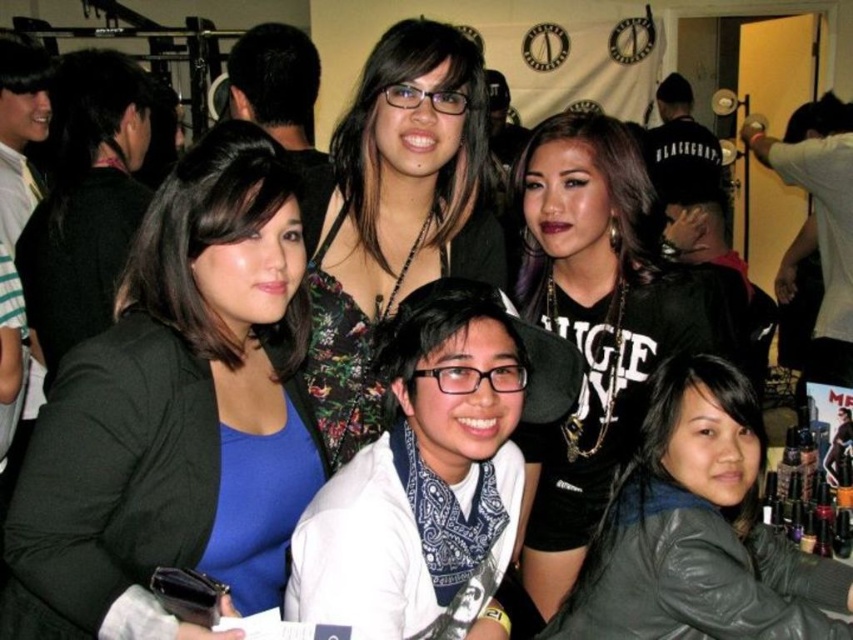
Is matte black blazer at left closer to the viewer compared to black leather jacket at center?

That is True.

Is point (216, 160) farther from camera compared to point (573, 170)?

No.

The height and width of the screenshot is (640, 853). In order to click on matte black blazer at left in this screenshot , I will do `click(172, 403)`.

Between point (546, 134) and point (726, 470), which one is positioned behind?

The point (546, 134) is behind.

Is point (590, 248) positioned in front of point (688, 486)?

No.

Who is more distant from viewer, [596,336] or [732,513]?

Positioned behind is point [596,336].

Where is `black leather jacket at center`? Image resolution: width=853 pixels, height=640 pixels. black leather jacket at center is located at coordinates (599, 326).

This screenshot has width=853, height=640. In order to click on floral fabric dress at center in this screenshot , I will do `click(393, 212)`.

Can you confirm if floral fabric dress at center is positioned to the left of leather jacket at lower right?

Yes, floral fabric dress at center is to the left of leather jacket at lower right.

I want to click on floral fabric dress at center, so click(x=393, y=212).